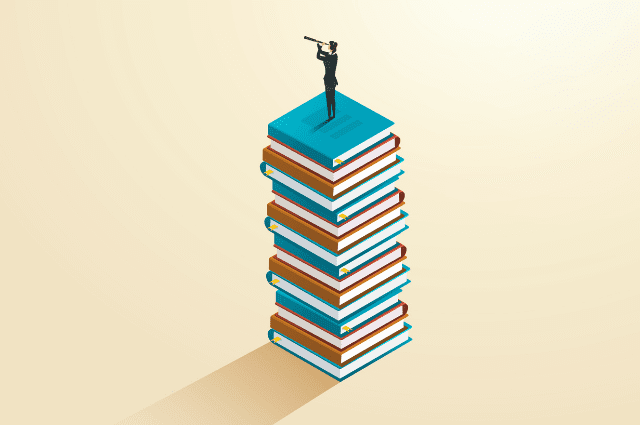
Identify the location of blue cover book. The image size is (640, 425). (269, 335), (290, 308), (267, 279), (287, 247), (265, 223), (284, 192), (260, 168), (317, 151).